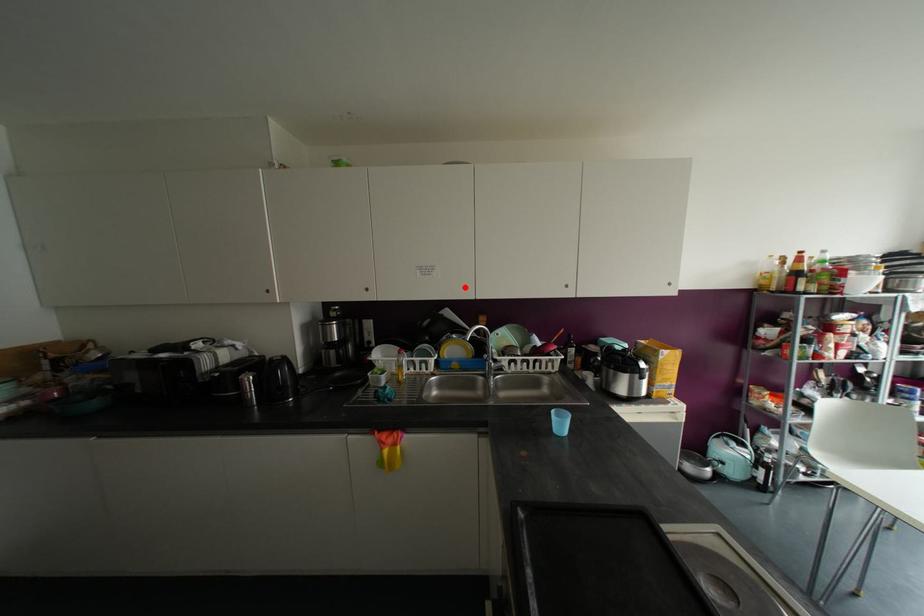
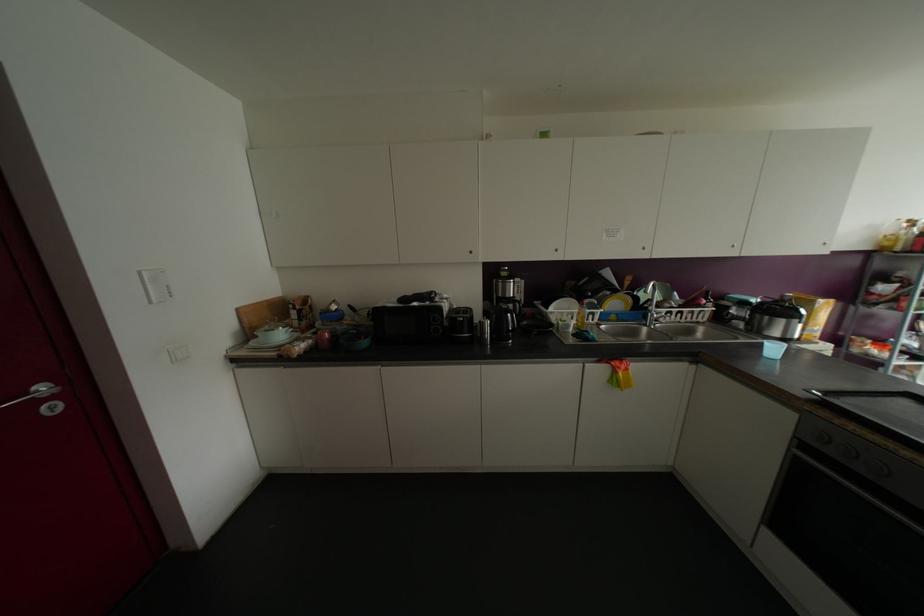
Locate, in the second image, the point that corresponds to the highlighted location in the first image.

(642, 248)